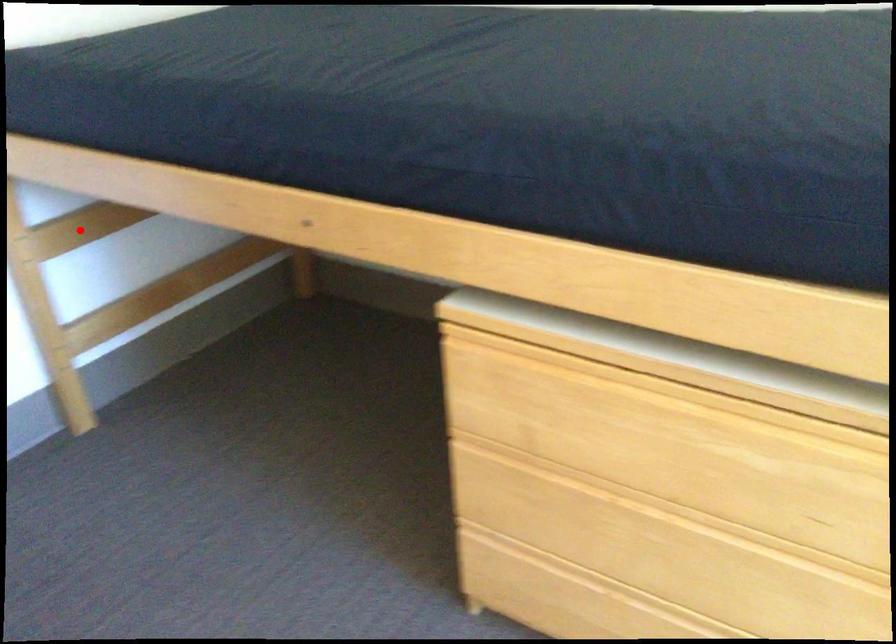
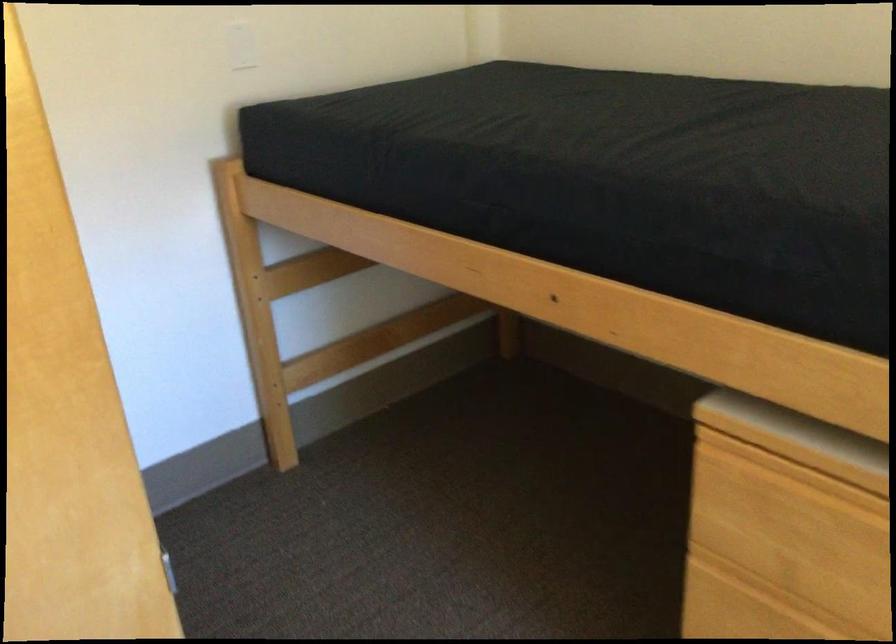
Where in the second image is the point corresponding to the highlighted location from the first image?

(307, 270)